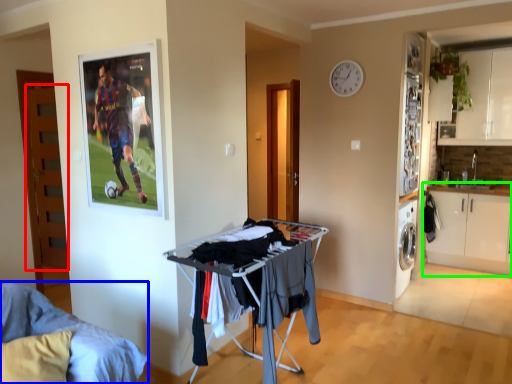
Question: Estimate the real-world distances between objects in this image. Which object is farther from door (highlighted by a red box), furniture (highlighted by a blue box) or cabinetry (highlighted by a green box)?

Choices:
 (A) furniture
 (B) cabinetry

Answer: (B)